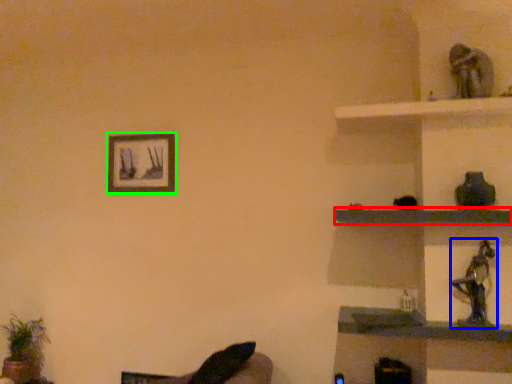
Question: Considering the real-world distances, which object is farthest from shelf (highlighted by a red box)? toy (highlighted by a blue box) or picture frame (highlighted by a green box)?

Choices:
 (A) toy
 (B) picture frame

Answer: (B)